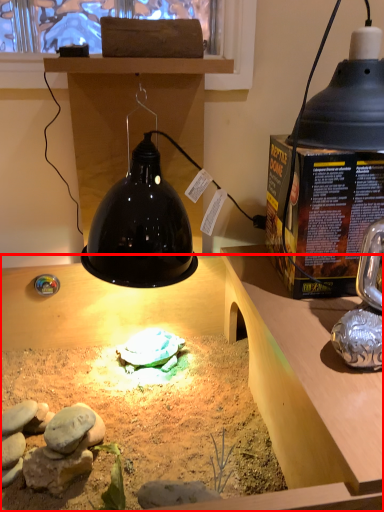
Question: Considering the relative positions of desk (annotated by the red box) and lamp in the image provided, where is desk (annotated by the red box) located with respect to the staircase?

Choices:
 (A) left
 (B) right

Answer: (A)